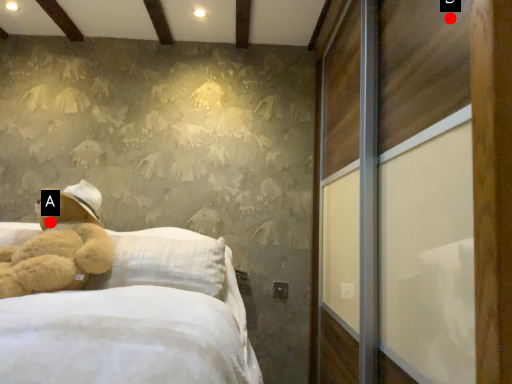
Question: Two points are circled on the image, labeled by A and B beside each circle. Which of the following is the farthest from the observer?

Choices:
 (A) A is further
 (B) B is further

Answer: (A)